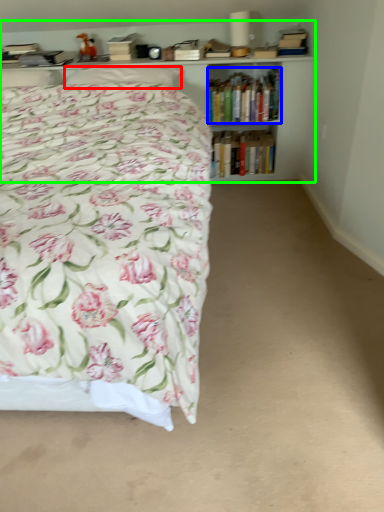
Question: Based on their relative distances, which object is farther from pillow (highlighted by a red box)? Choose from book (highlighted by a blue box) and bookcase (highlighted by a green box).

Choices:
 (A) book
 (B) bookcase

Answer: (A)